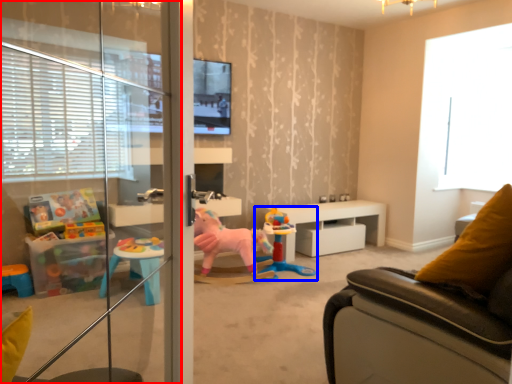
Question: Which point is further to the camera, screen door (highlighted by a red box) or toy (highlighted by a blue box)?

Choices:
 (A) screen door
 (B) toy

Answer: (B)